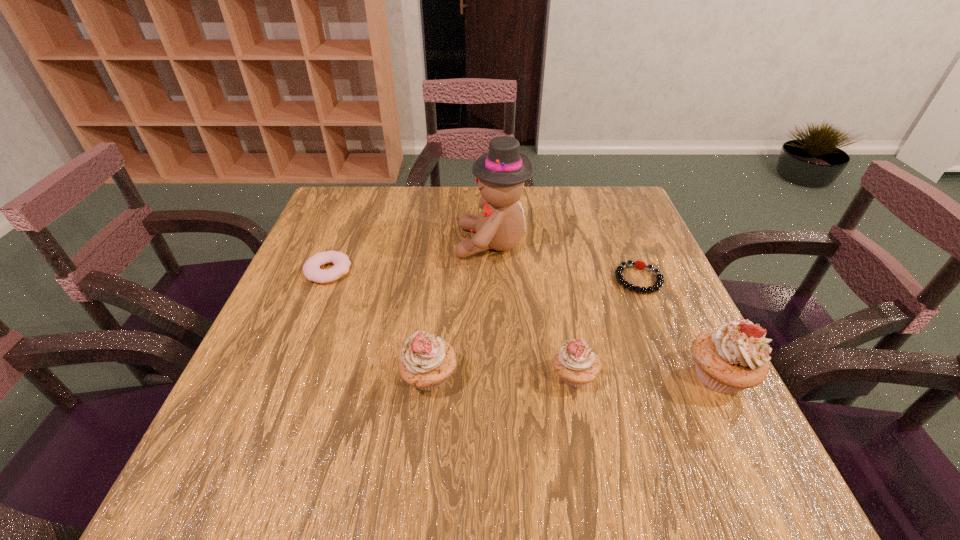
Where is `cupcake that is at the right edge`? This screenshot has width=960, height=540. cupcake that is at the right edge is located at coordinates (733, 357).

In order to click on bracelet that is positioned at the right edge in this screenshot , I will do `click(659, 282)`.

At what (x,y) coordinates should I click in order to perform the action: click on object located at the near right corner. Please return your answer as a coordinate pair (x, y). Looking at the image, I should click on (733, 357).

This screenshot has height=540, width=960. I want to click on free space at the far edge of the desktop, so (414, 219).

Where is `blank area at the near edge`? The image size is (960, 540). blank area at the near edge is located at coordinates (514, 407).

In the image, there is a desktop. Where is `vacant space at the left edge`? vacant space at the left edge is located at coordinates (253, 381).

The image size is (960, 540). In order to click on blank area at the right edge in this screenshot , I will do `click(625, 247)`.

This screenshot has width=960, height=540. In the image, there is a desktop. What are the coordinates of `free space at the far left corner` in the screenshot? It's located at (325, 226).

In the image, there is a desktop. What are the coordinates of `vacant space at the near left corner` in the screenshot? It's located at (258, 415).

What are the coordinates of `vacant space at the far right corner` in the screenshot? It's located at (584, 211).